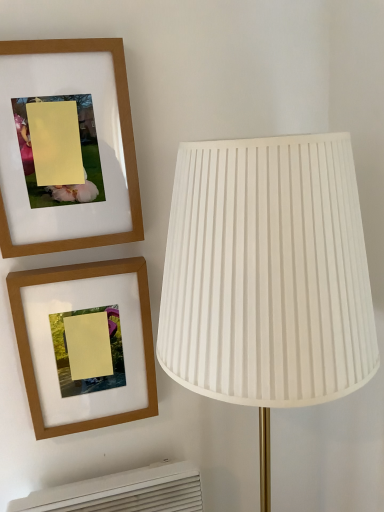
What are the coordinates of `wooden frame at upper left, the 1th picture frame viewed from the top` in the screenshot? It's located at (122, 141).

Where is `white pleated fabric lampshade at right`? The height and width of the screenshot is (512, 384). white pleated fabric lampshade at right is located at coordinates (267, 277).

Measure the distance between white pleated fabric lampshade at right and camera.

white pleated fabric lampshade at right and camera are 19.53 inches apart.

Where is `wooden frame at upper left, which appears as the second picture frame when ordered from the bottom`? Image resolution: width=384 pixels, height=512 pixels. wooden frame at upper left, which appears as the second picture frame when ordered from the bottom is located at coordinates (122, 141).

The width and height of the screenshot is (384, 512). What are the coordinates of `lamp that appears in front of the wooden frame at upper left, the 2th picture frame from the top` in the screenshot? It's located at (267, 277).

In terms of size, does white pleated fabric lampshade at right appear bigger or smaller than wooden frame at upper left, the 2th picture frame from the top?

Considering their sizes, white pleated fabric lampshade at right takes up more space than wooden frame at upper left, the 2th picture frame from the top.

Considering their positions, is white pleated fabric lampshade at right located in front of or behind wooden frame at upper left, the 2th picture frame from the top?

In the image, white pleated fabric lampshade at right appears in front of wooden frame at upper left, the 2th picture frame from the top.

Is wooden frame at upper left, which appears as the second picture frame when ordered from the bottom, wider than white plastic air conditioner at lower left?

In fact, wooden frame at upper left, which appears as the second picture frame when ordered from the bottom, might be narrower than white plastic air conditioner at lower left.

Are wooden frame at upper left, the 1th picture frame viewed from the top, and white plastic air conditioner at lower left located far from each other?

No, wooden frame at upper left, the 1th picture frame viewed from the top, is not far from white plastic air conditioner at lower left.

Which is nearer, (42, 250) or (150, 509)?

Point (42, 250) appears to be closer to the viewer than point (150, 509).

Considering the relative sizes of wooden frame at upper left, the 1th picture frame viewed from the top, and white plastic air conditioner at lower left in the image provided, is wooden frame at upper left, the 1th picture frame viewed from the top, shorter than white plastic air conditioner at lower left?

No.

Is wooden frame at upper left, the 1th picture frame viewed from the top, outside of wooden frame at upper left, the first picture frame ordered from the bottom?

That's correct, wooden frame at upper left, the 1th picture frame viewed from the top, is outside of wooden frame at upper left, the first picture frame ordered from the bottom.

Is wooden frame at upper left, the 1th picture frame viewed from the top, closer to the viewer compared to wooden frame at upper left, the first picture frame ordered from the bottom?

Yes.

Looking at this image, how different are the orientations of white pleated fabric lampshade at right and white plastic air conditioner at lower left in degrees?

0.000678 degrees.

Is white pleated fabric lampshade at right directly adjacent to white plastic air conditioner at lower left?

white pleated fabric lampshade at right and white plastic air conditioner at lower left are not in contact.

Between white pleated fabric lampshade at right and white plastic air conditioner at lower left, which one has more height?

With more height is white pleated fabric lampshade at right.

Does white pleated fabric lampshade at right have a lesser width compared to white plastic air conditioner at lower left?

No.

Does white pleated fabric lampshade at right contain wooden frame at upper left, which appears as the second picture frame when ordered from the bottom?

Actually, wooden frame at upper left, which appears as the second picture frame when ordered from the bottom, is outside white pleated fabric lampshade at right.

Is white pleated fabric lampshade at right at the left side of wooden frame at upper left, the 1th picture frame viewed from the top?

Incorrect, white pleated fabric lampshade at right is not on the left side of wooden frame at upper left, the 1th picture frame viewed from the top.

Does point (198, 387) appear closer or farther from the camera than point (120, 39)?

Point (198, 387).

From the picture: From the image's perspective, which object appears higher, white pleated fabric lampshade at right or wooden frame at upper left, the 1th picture frame viewed from the top?

From the image's view, wooden frame at upper left, the 1th picture frame viewed from the top, is above.

Is wooden frame at upper left, the first picture frame ordered from the bottom, inside the boundaries of white plastic air conditioner at lower left, or outside?

wooden frame at upper left, the first picture frame ordered from the bottom, cannot be found inside white plastic air conditioner at lower left.

From their relative heights in the image, would you say wooden frame at upper left, the 2th picture frame from the top, is taller or shorter than white plastic air conditioner at lower left?

Considering their sizes, wooden frame at upper left, the 2th picture frame from the top, has more height than white plastic air conditioner at lower left.

Measure the distance between wooden frame at upper left, the 2th picture frame from the top, and white plastic air conditioner at lower left.

wooden frame at upper left, the 2th picture frame from the top, and white plastic air conditioner at lower left are 7.87 inches apart from each other.

Which object is positioned more to the left, wooden frame at upper left, the first picture frame ordered from the bottom, or white plastic air conditioner at lower left?

wooden frame at upper left, the first picture frame ordered from the bottom.

Identify the location of picture frame that is the 1st one when counting upward from the white plastic air conditioner at lower left (from the image's perspective). The height and width of the screenshot is (512, 384). (29, 345).

In terms of height, does white plastic air conditioner at lower left look taller or shorter compared to wooden frame at upper left, the 2th picture frame from the top?

Clearly, white plastic air conditioner at lower left is shorter compared to wooden frame at upper left, the 2th picture frame from the top.

Could you tell me if white plastic air conditioner at lower left is turned towards wooden frame at upper left, the 2th picture frame from the top?

No.

Is white plastic air conditioner at lower left directly adjacent to wooden frame at upper left, the first picture frame ordered from the bottom?

They are not placed beside each other.

From a real-world perspective, starting from the white pleated fabric lampshade at right, which picture frame is the 1st one vertically above it? Please provide its 2D coordinates.

[(29, 345)]

What are the coordinates of `air conditioner below the wooden frame at upper left, which appears as the second picture frame when ordered from the bottom (from a real-world perspective)` in the screenshot? It's located at (124, 492).

From the picture: When comparing their distances from wooden frame at upper left, which appears as the second picture frame when ordered from the bottom, does white pleated fabric lampshade at right or white plastic air conditioner at lower left seem further?

Among the two, white plastic air conditioner at lower left is located further to wooden frame at upper left, which appears as the second picture frame when ordered from the bottom.

Considering their positions, is wooden frame at upper left, the first picture frame ordered from the bottom, positioned closer to wooden frame at upper left, the 1th picture frame viewed from the top, than white plastic air conditioner at lower left?

wooden frame at upper left, the first picture frame ordered from the bottom.

Consider the image. Considering their positions, is white pleated fabric lampshade at right positioned closer to white plastic air conditioner at lower left than wooden frame at upper left, which appears as the second picture frame when ordered from the bottom?

Among the two, white pleated fabric lampshade at right is located nearer to white plastic air conditioner at lower left.

Which object lies nearer to the anchor point white plastic air conditioner at lower left, wooden frame at upper left, the 1th picture frame viewed from the top, or white pleated fabric lampshade at right?

white pleated fabric lampshade at right.

Considering their positions, is white plastic air conditioner at lower left positioned closer to white pleated fabric lampshade at right than wooden frame at upper left, the 1th picture frame viewed from the top?

wooden frame at upper left, the 1th picture frame viewed from the top, lies closer to white pleated fabric lampshade at right than the other object.

Considering their positions, is wooden frame at upper left, the first picture frame ordered from the bottom, positioned further to white pleated fabric lampshade at right than white plastic air conditioner at lower left?

white plastic air conditioner at lower left lies further to white pleated fabric lampshade at right than the other object.

Estimate the real-world distances between objects in this image. Which object is closer to wooden frame at upper left, which appears as the second picture frame when ordered from the bottom, white plastic air conditioner at lower left or wooden frame at upper left, the 2th picture frame from the top?

The object closer to wooden frame at upper left, which appears as the second picture frame when ordered from the bottom, is wooden frame at upper left, the 2th picture frame from the top.

When comparing their distances from white pleated fabric lampshade at right, does white plastic air conditioner at lower left or wooden frame at upper left, the 2th picture frame from the top, seem closer?

The object closer to white pleated fabric lampshade at right is wooden frame at upper left, the 2th picture frame from the top.

The width and height of the screenshot is (384, 512). In order to click on picture frame between wooden frame at upper left, which appears as the second picture frame when ordered from the bottom, and white pleated fabric lampshade at right from top to bottom in this screenshot , I will do `click(29, 345)`.

This screenshot has height=512, width=384. I want to click on lamp between wooden frame at upper left, which appears as the second picture frame when ordered from the bottom, and white plastic air conditioner at lower left, in the vertical direction, so click(x=267, y=277).

This screenshot has width=384, height=512. I want to click on picture frame that lies between wooden frame at upper left, the 1th picture frame viewed from the top, and white plastic air conditioner at lower left from top to bottom, so click(29, 345).